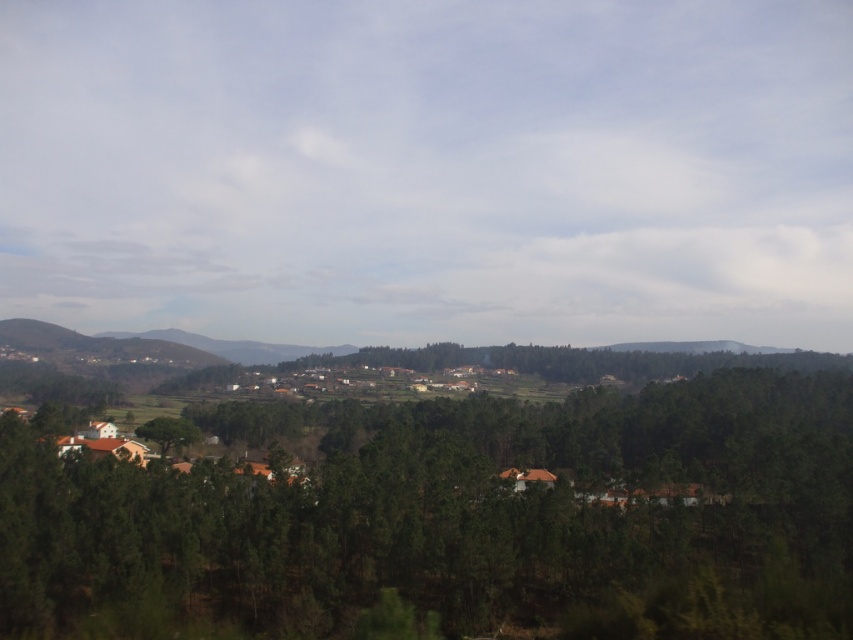
Question: Which point is closer to the camera?

Choices:
 (A) (100, 609)
 (B) (120, 333)

Answer: (A)

Question: Observing the image, what is the correct spatial positioning of green matte trees at center in reference to green forested mountain at center?

Choices:
 (A) right
 (B) left

Answer: (A)

Question: Can you confirm if green matte trees at center is bigger than green matte tree at center?

Choices:
 (A) no
 (B) yes

Answer: (B)

Question: Is green matte trees at center to the right of green matte tree at center from the viewer's perspective?

Choices:
 (A) no
 (B) yes

Answer: (B)

Question: Estimate the real-world distances between objects in this image. Which object is farther from the green matte tree at center?

Choices:
 (A) green forested mountain at center
 (B) green matte trees at center

Answer: (A)

Question: Which point appears closest to the camera in this image?

Choices:
 (A) (212, 340)
 (B) (805, 538)

Answer: (B)